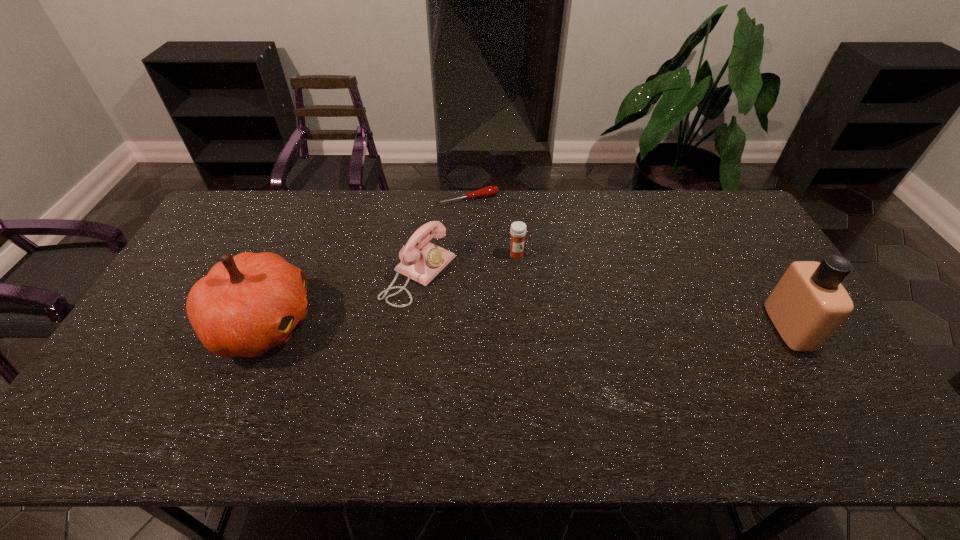
This screenshot has height=540, width=960. What are the coordinates of `vacant spot on the desktop that is between the pumpkin and the rightmost object and is positioned on the label side of the medicine` in the screenshot? It's located at (581, 325).

This screenshot has height=540, width=960. Find the location of `vacant space on the desktop that is between the leftmost object and the perfume and is positioned at the tip of the screwdriver`. vacant space on the desktop that is between the leftmost object and the perfume and is positioned at the tip of the screwdriver is located at coordinates (543, 325).

At what (x,y) coordinates should I click in order to perform the action: click on vacant space on the desktop that is between the leftmost object and the perfume and is positioned on the dial of the third shortest object. Please return your answer as a coordinate pair (x, y). Looking at the image, I should click on (521, 325).